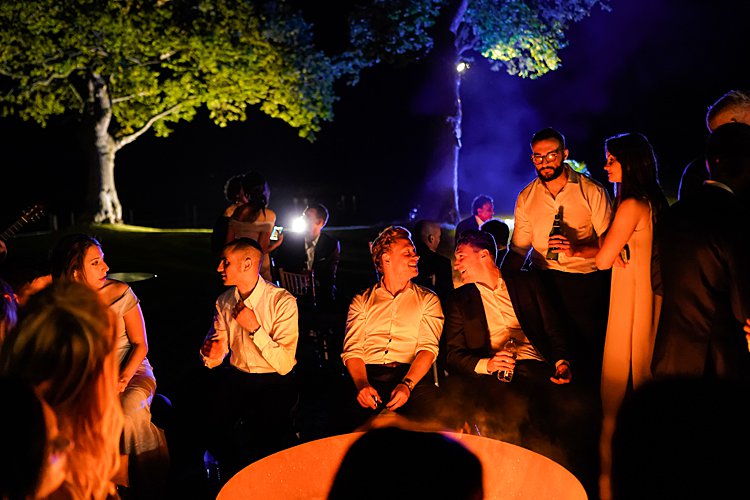
Where is `alcohol bottle`? The image size is (750, 500). alcohol bottle is located at coordinates (555, 226).